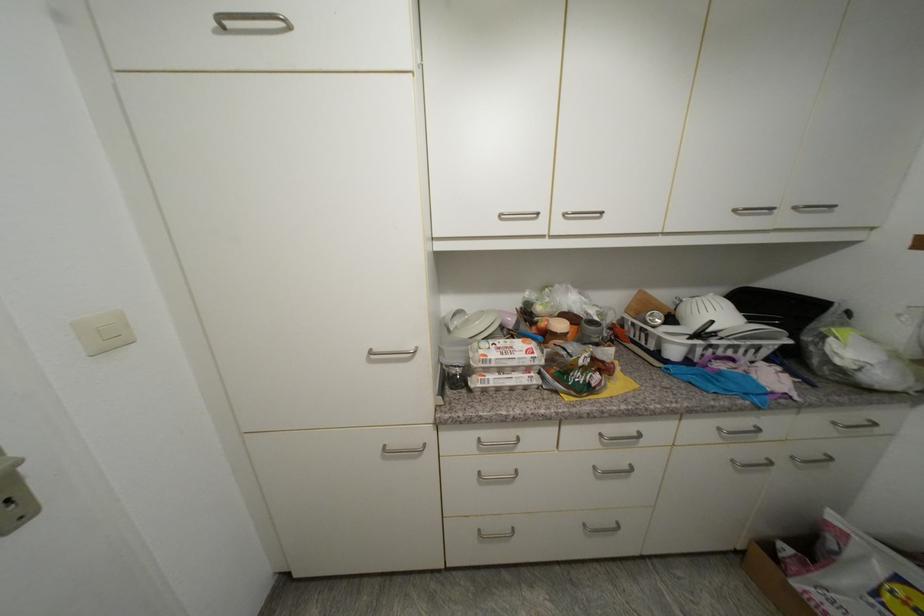
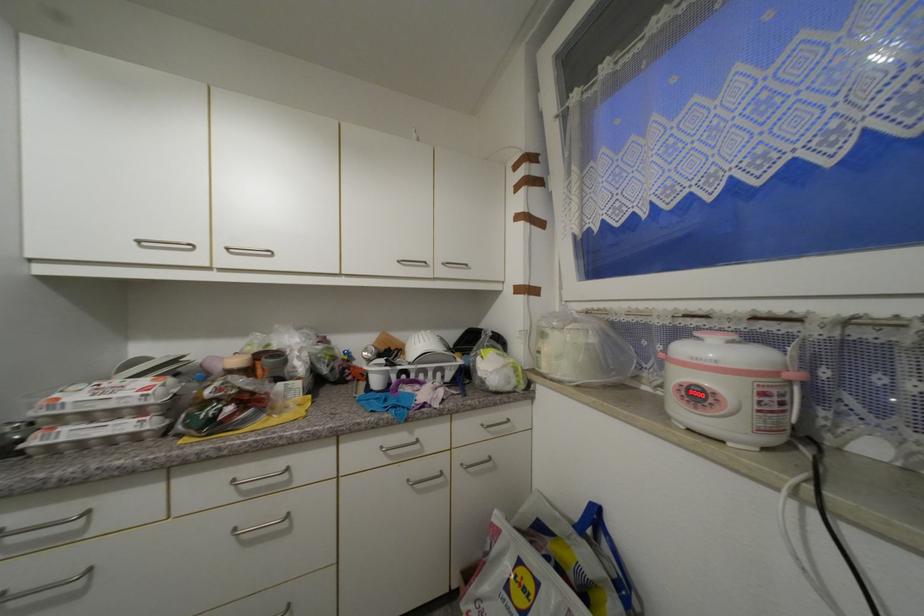
In the second image, find the point that corresponds to pixel 606 436 in the first image.

(238, 483)